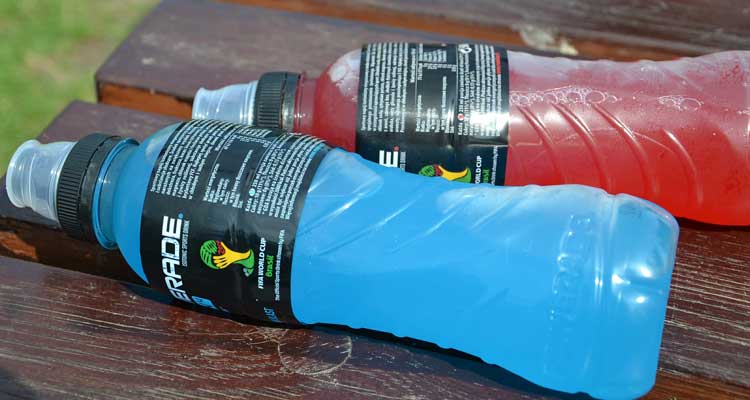
At what (x,y) coordinates should I click in order to perform the action: click on cup. Please return your answer as a coordinate pair (x, y). The image size is (750, 400). Looking at the image, I should click on (262, 245).